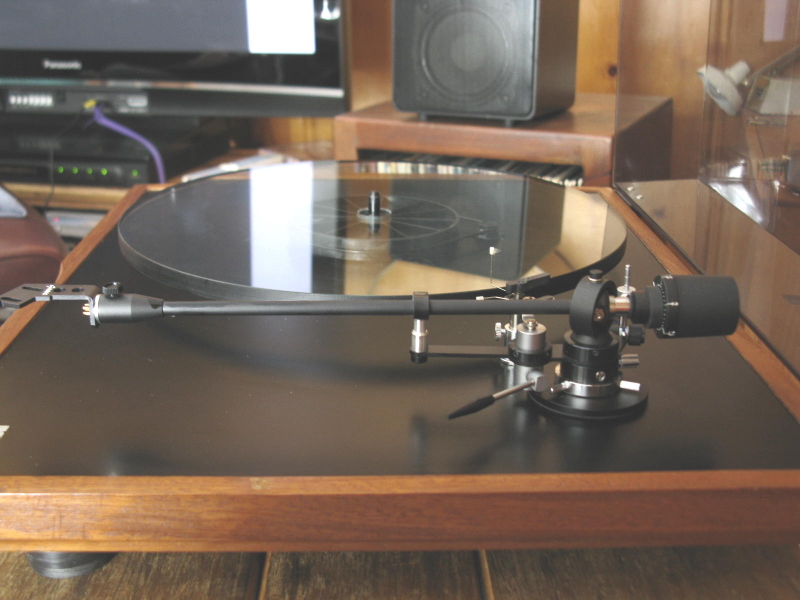
Locate an element on the screen. Image resolution: width=800 pixels, height=600 pixels. wooden frame is located at coordinates (154, 519).